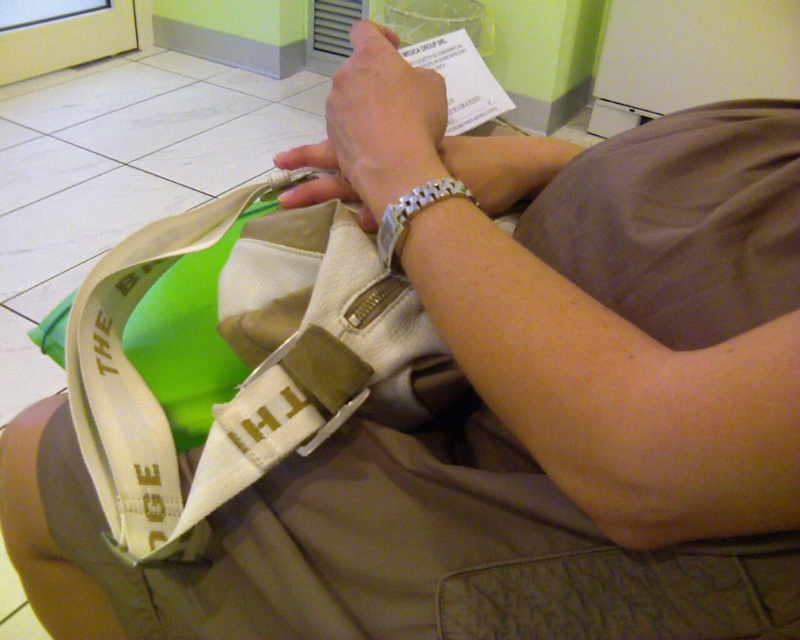
Question: Does textured olive-green pocket at lower center appear on the left side of silver metallic bracelet at upper center?

Choices:
 (A) no
 (B) yes

Answer: (A)

Question: Can you confirm if textured olive-green pocket at lower center is positioned below silver metallic bracelet at upper center?

Choices:
 (A) yes
 (B) no

Answer: (A)

Question: Which of these objects is positioned closest to the silver metallic watch at upper center?

Choices:
 (A) textured olive-green pocket at lower center
 (B) silver metallic bracelet at upper center

Answer: (B)

Question: Estimate the real-world distances between objects in this image. Which object is farther from the textured olive-green pocket at lower center?

Choices:
 (A) silver metallic bracelet at upper center
 (B) silver metallic watch at upper center

Answer: (B)

Question: Is textured olive-green pocket at lower center smaller than silver metallic bracelet at upper center?

Choices:
 (A) yes
 (B) no

Answer: (B)

Question: Among these points, which one is farthest from the camera?

Choices:
 (A) (400, 168)
 (B) (729, 547)
 (C) (438, 186)

Answer: (A)